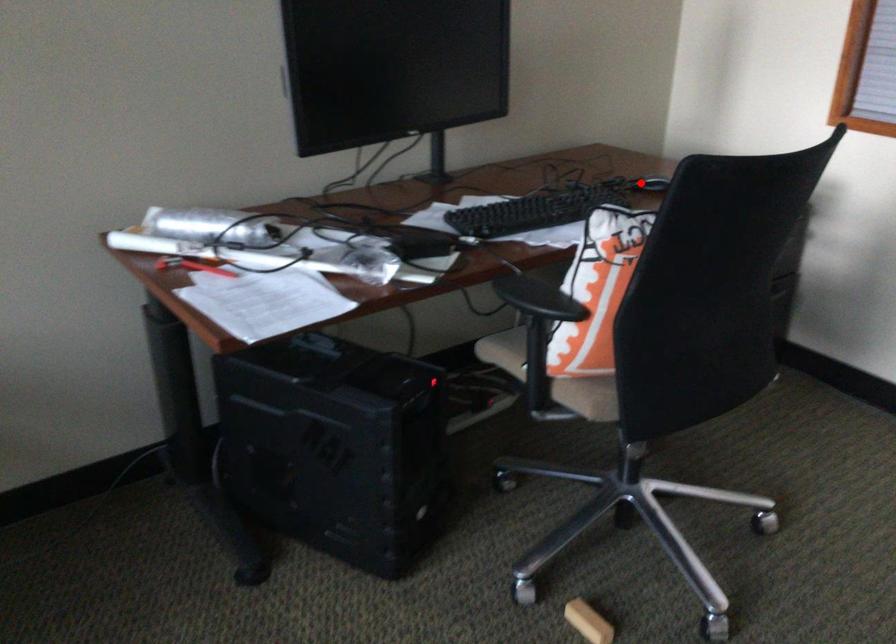
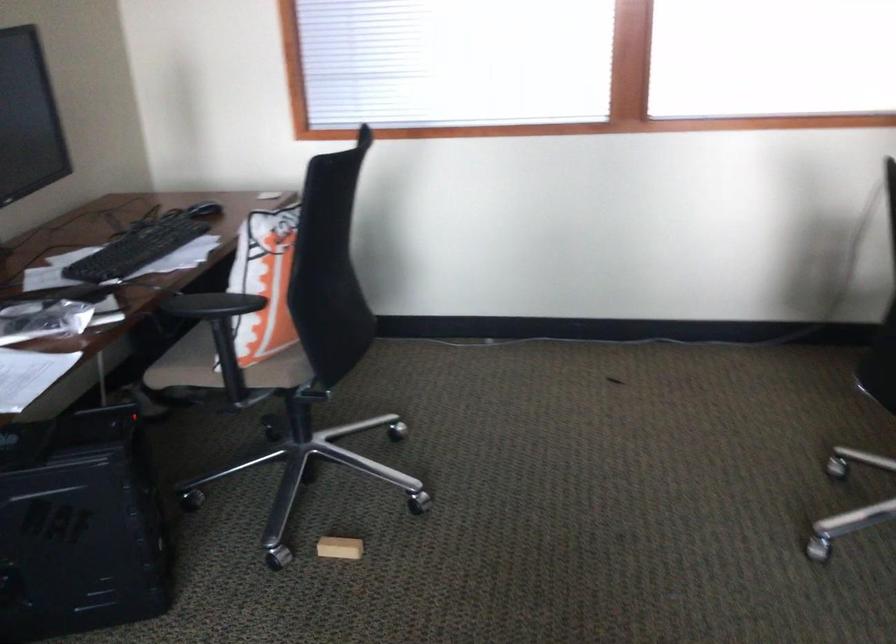
In the second image, find the point that corresponds to the highlighted location in the first image.

(204, 210)